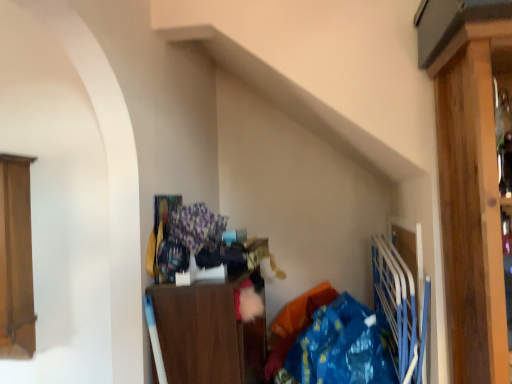
Question: Is wooden cabinet at left, which ranks as the 1th cabinetry in left-to-right order, shorter than blue plastic bag at lower right?

Choices:
 (A) yes
 (B) no

Answer: (B)

Question: Considering the relative sizes of wooden cabinet at left, positioned as the second cabinetry in right-to-left order, and blue plastic bag at lower right in the image provided, is wooden cabinet at left, positioned as the second cabinetry in right-to-left order, thinner than blue plastic bag at lower right?

Choices:
 (A) no
 (B) yes

Answer: (B)

Question: Considering the relative sizes of wooden cabinet at left, positioned as the second cabinetry in right-to-left order, and blue plastic bag at lower right in the image provided, is wooden cabinet at left, positioned as the second cabinetry in right-to-left order, bigger than blue plastic bag at lower right?

Choices:
 (A) yes
 (B) no

Answer: (B)

Question: Is wooden cabinet at left, which ranks as the 1th cabinetry in left-to-right order, to the left of blue plastic bag at lower right from the viewer's perspective?

Choices:
 (A) no
 (B) yes

Answer: (B)

Question: Is wooden cabinet at left, positioned as the second cabinetry in right-to-left order, positioned before blue plastic bag at lower right?

Choices:
 (A) no
 (B) yes

Answer: (A)

Question: Would you say wooden cabinet at left, positioned as the second cabinetry in right-to-left order, is to the left or to the right of blue plastic bag at lower right in the picture?

Choices:
 (A) right
 (B) left

Answer: (B)

Question: Relative to blue plastic bag at lower right, is wooden cabinet at left, positioned as the second cabinetry in right-to-left order, in front or behind?

Choices:
 (A) front
 (B) behind

Answer: (B)

Question: From the image's perspective, relative to blue plastic bag at lower right, is wooden cabinet at left, positioned as the second cabinetry in right-to-left order, above or below?

Choices:
 (A) below
 (B) above

Answer: (B)

Question: Is wooden cabinet at left, which ranks as the 1th cabinetry in left-to-right order, inside the boundaries of blue plastic bag at lower right, or outside?

Choices:
 (A) inside
 (B) outside

Answer: (B)

Question: Relative to blue plastic bag at lower right, is wooden cabinet at center, arranged as the 2th cabinetry when viewed from the left, in front or behind?

Choices:
 (A) front
 (B) behind

Answer: (B)

Question: Is wooden cabinet at center, arranged as the 2th cabinetry when viewed from the left, inside or outside of blue plastic bag at lower right?

Choices:
 (A) outside
 (B) inside

Answer: (A)

Question: From a real-world perspective, is wooden cabinet at center, arranged as the 2th cabinetry when viewed from the left, above or below blue plastic bag at lower right?

Choices:
 (A) below
 (B) above

Answer: (B)

Question: From their relative heights in the image, would you say wooden cabinet at center, which ranks as the first cabinetry in right-to-left order, is taller or shorter than blue plastic bag at lower right?

Choices:
 (A) tall
 (B) short

Answer: (A)

Question: From the image's perspective, relative to wooden cabinet at center, which ranks as the first cabinetry in right-to-left order, is blue plastic bag at lower right above or below?

Choices:
 (A) below
 (B) above

Answer: (A)

Question: Is blue plastic bag at lower right inside or outside of wooden cabinet at center, arranged as the 2th cabinetry when viewed from the left?

Choices:
 (A) inside
 (B) outside

Answer: (B)